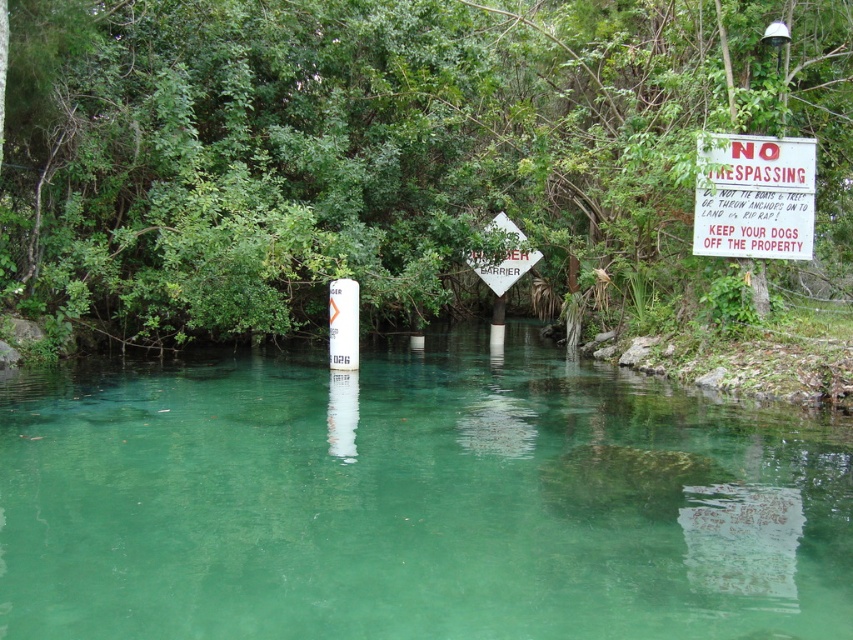
In the scene shown: Who is more forward, (86, 492) or (727, 180)?

Point (86, 492) is in front.

Between green translucent water at center and red plastic sign at upper right, which one has more height?

Standing taller between the two is red plastic sign at upper right.

Between point (456, 608) and point (793, 180), which one is positioned behind?

Point (793, 180)

This screenshot has height=640, width=853. I want to click on green translucent water at center, so click(x=415, y=500).

Does red plastic sign at upper right appear on the right side of white diamond-shaped sign at center?

Indeed, red plastic sign at upper right is positioned on the right side of white diamond-shaped sign at center.

Is red plastic sign at upper right taller than white diamond-shaped sign at center?

Incorrect, red plastic sign at upper right's height is not larger of white diamond-shaped sign at center's.

Is point (701, 224) behind point (509, 259)?

No, (701, 224) is closer to viewer.

Where is `red plastic sign at upper right`? The image size is (853, 640). red plastic sign at upper right is located at coordinates (753, 196).

From the picture: Can you confirm if green translucent water at center is wider than white diamond-shaped sign at center?

Yes.

Does point (766, 509) lie in front of point (497, 288)?

Yes, point (766, 509) is closer to viewer.

Where is `green translucent water at center`? Image resolution: width=853 pixels, height=640 pixels. green translucent water at center is located at coordinates (415, 500).